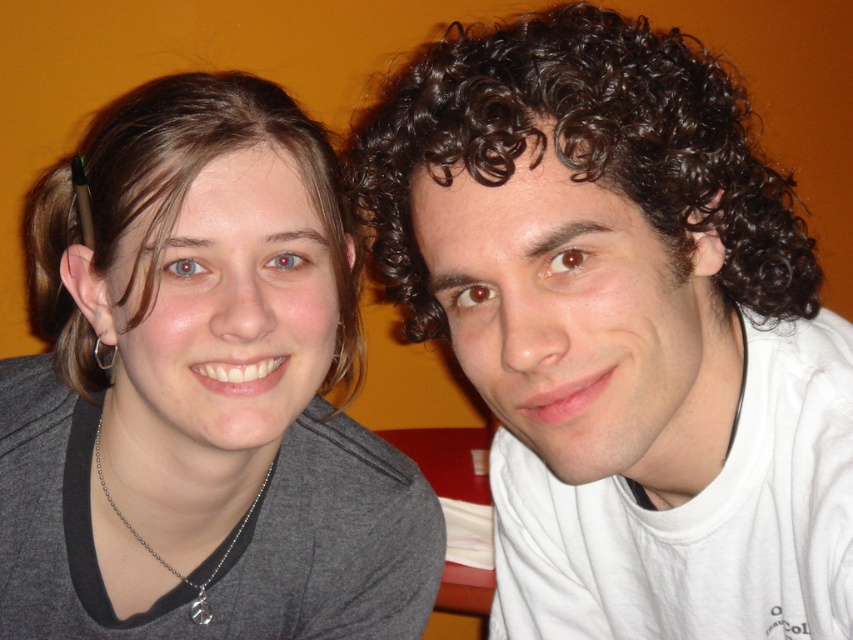
You are a photographer adjusting the focus on your camera. You want to ensure that both people in the photo are in focus. The camera can only focus on objects within a 15 inch range. Given that the dark brown curly hair at center is 17.37 inches from the camera, can you confirm if both subjects are within the focus range?

The dark brown curly hair at center is 17.37 inches from the camera, which is outside the 15 inch focus range. Therefore, the subject with dark brown curly hair at center will be out of focus.

From the picture: You are a photographer trying to capture a clear photo of the two people. The gray fabric at left and brown smooth hair at left are close to each other. Do you think there is enough space between them to avoid blurring both in the photo?

The gray fabric at left and brown smooth hair at left are 2.02 inches apart from each other. This distance should be sufficient to keep both elements distinct in the photo, preventing blurring as long as the camera settings are appropriate for the lighting conditions.